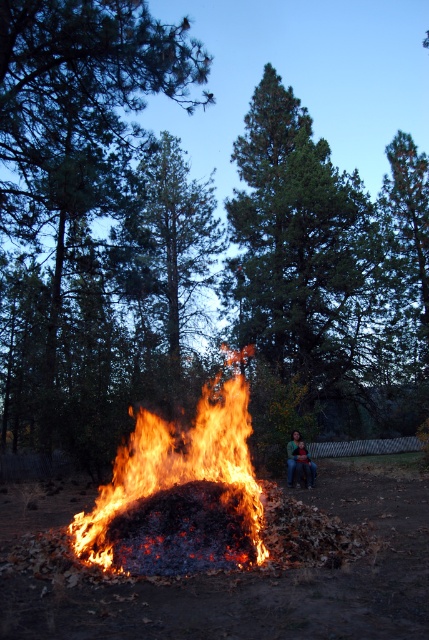
Can you confirm if flaming wood at center is positioned to the left of green knitted sweater at center?

Indeed, flaming wood at center is positioned on the left side of green knitted sweater at center.

Is point (214, 460) positioned behind point (290, 458)?

No, it is not.

Which is behind, point (218, 401) or point (296, 435)?

The point (296, 435) is more distant.

I want to click on flaming wood at center, so click(x=181, y=465).